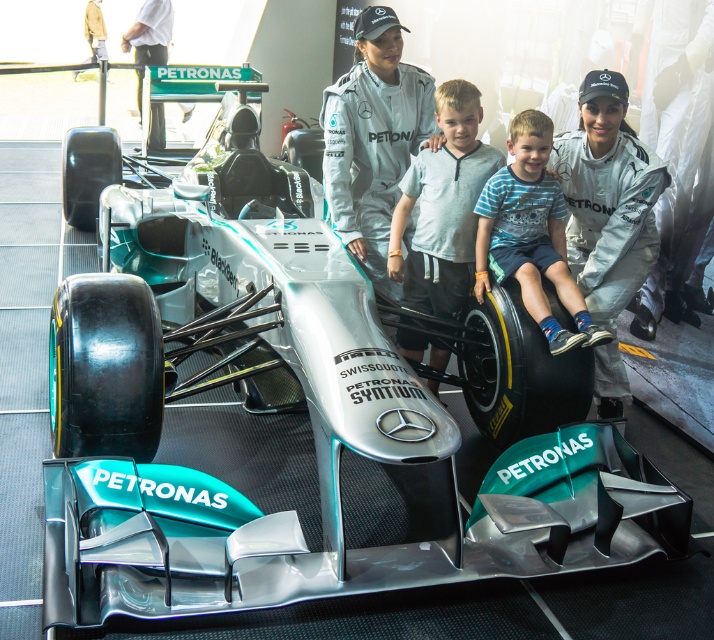
You are a photographer at the exhibition and want to capture both the blue striped shirt at center and the white fabric shirt at upper left in a single shot. Which shirt should you focus on first to ensure both are in frame?

The blue striped shirt at center is not as tall as the white fabric shirt at upper left, so you should focus on the white fabric shirt at upper left first to ensure both are in frame.

You are a photographer trying to capture a closeup shot of the white matte racing suit at center and the blue striped shirt at center. What is the minimum distance you need to set your camera lens to focus on both subjects simultaneously?

The minimum distance you need to set your camera lens is 15.77 inches to focus on both the white matte racing suit at center and the blue striped shirt at center simultaneously.

You are a photographer standing in front of the Formula One car and want to take a photo of both the white matte racing suit at center and the blue striped shirt at center. Which one should you focus on first to ensure both are in sharp focus?

You should focus on the white matte racing suit at center first because it is closer to you than the blue striped shirt at center, ensuring both will be in focus when using a shallow depth of field.